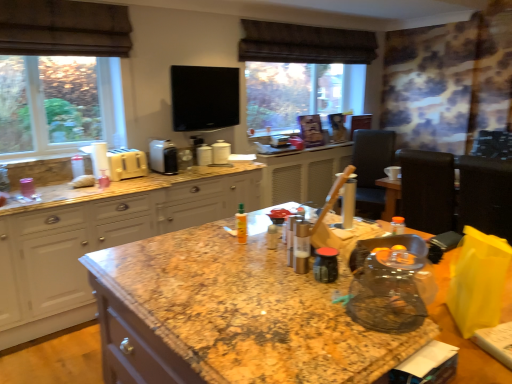
This screenshot has height=384, width=512. Find the location of `free space in front of bread dough at left`. free space in front of bread dough at left is located at coordinates (83, 188).